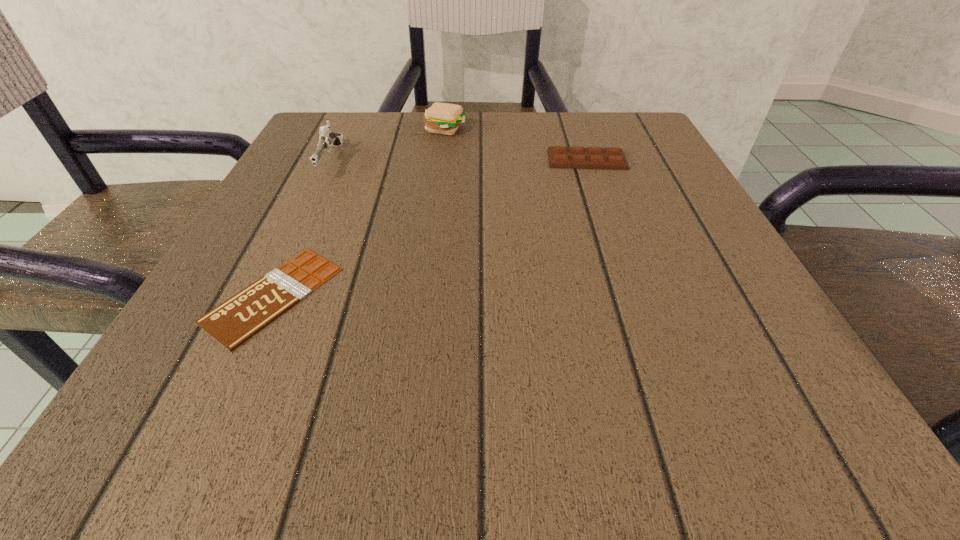
You are a GUI agent. You are given a task and a screenshot of the screen. Output one action in this format:
    pyautogui.click(x=<x>, y=<y>)
    Task: Click on the free location at the near edge
    The image size is (960, 540).
    Given the screenshot: What is the action you would take?
    pyautogui.click(x=430, y=373)

Image resolution: width=960 pixels, height=540 pixels. I want to click on free space at the left edge, so click(x=295, y=178).

Locate an element on the screen. free space at the right edge of the desktop is located at coordinates (674, 237).

The image size is (960, 540). I want to click on vacant space at the far right corner, so click(x=603, y=126).

At what (x,y) coordinates should I click in order to perform the action: click on vacant point located between the left chocolate bar and the second object from right to left. Please return your answer as a coordinate pair (x, y). The image size is (960, 540). Looking at the image, I should click on pos(360,212).

Image resolution: width=960 pixels, height=540 pixels. Find the location of `empty space that is in between the right chocolate bar and the left chocolate bar`. empty space that is in between the right chocolate bar and the left chocolate bar is located at coordinates (430, 227).

Locate an element on the screen. The height and width of the screenshot is (540, 960). free space between the shorter chocolate bar and the right chocolate bar is located at coordinates (430, 227).

The height and width of the screenshot is (540, 960). What are the coordinates of `vacant area that lies between the second object from right to left and the rightmost object` in the screenshot? It's located at (516, 144).

Where is `unoccupied area between the farther chocolate bar and the shorter chocolate bar`? The height and width of the screenshot is (540, 960). unoccupied area between the farther chocolate bar and the shorter chocolate bar is located at coordinates (430, 227).

Find the location of a particular element. empty space that is in between the left chocolate bar and the tallest object is located at coordinates (302, 228).